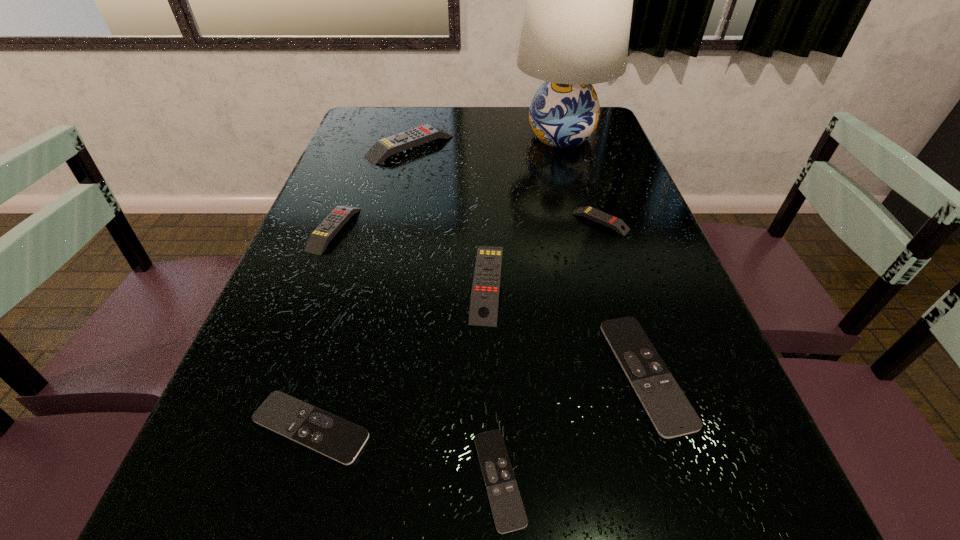
The image size is (960, 540). Identify the location of empty location between the rightmost yellow remote control and the farthest yellow remote control. (505, 184).

The height and width of the screenshot is (540, 960). In order to click on free space between the blue lampshade and the shortest object in this screenshot , I will do `click(530, 308)`.

Locate an element on the screen. vacant space that's between the fifth tallest object and the blue lampshade is located at coordinates (581, 179).

Locate an element on the screen. The width and height of the screenshot is (960, 540). empty space between the second black remote control from left to right and the second yellow remote control from right to left is located at coordinates (493, 381).

Image resolution: width=960 pixels, height=540 pixels. Identify the location of free point between the farthest yellow remote control and the third tallest object. (449, 214).

At what (x,y) coordinates should I click in order to perform the action: click on vacant space in between the fifth shortest object and the sixth tallest remote control. Please return your answer as a coordinate pair (x, y). Looking at the image, I should click on (323, 328).

I want to click on object that is the seventh closest to the lampshade, so click(x=509, y=515).

Identify which object is located as the fifth nearest to the second tallest remote control. Please provide its 2D coordinates. Your answer should be formatted as a tuple, i.e. [(x, y)], where the tuple contains the x and y coordinates of a point satisfying the conditions above.

[(318, 240)]

You are a GUI agent. You are given a task and a screenshot of the screen. Output one action in this format:
    pyautogui.click(x=<x>, y=<y>)
    Task: Click on the remote control that is the fifth nearest to the second smallest yellow remote control
    The image size is (960, 540).
    Given the screenshot: What is the action you would take?
    pyautogui.click(x=598, y=216)

Identify the location of the fifth closest remote control to the tallest remote control. This screenshot has width=960, height=540. (321, 431).